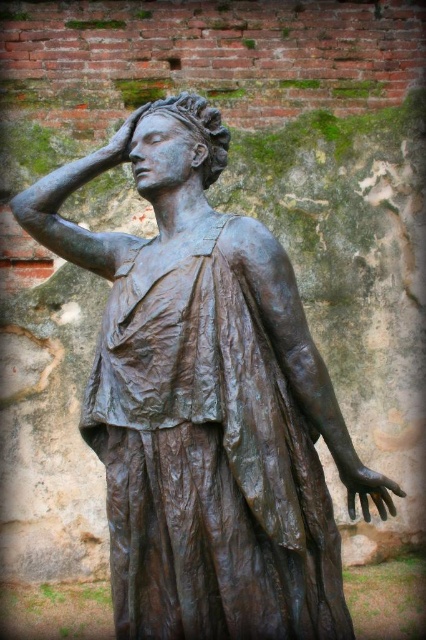
Question: Which point is farther from the camera taking this photo?

Choices:
 (A) (149, 112)
 (B) (121, 156)

Answer: (A)

Question: Is bronze hand at center below bronze hand at upper center?

Choices:
 (A) yes
 (B) no

Answer: (A)

Question: From the image, what is the correct spatial relationship of bronze statue head at center in relation to bronze hand at upper center?

Choices:
 (A) below
 (B) above

Answer: (A)

Question: Can you confirm if bronze statue head at center is bigger than bronze hand at upper center?

Choices:
 (A) no
 (B) yes

Answer: (B)

Question: Which point is closer to the camera?

Choices:
 (A) (222, 163)
 (B) (370, 486)

Answer: (B)

Question: Which of the following is the farthest from the observer?

Choices:
 (A) bronze hand at upper center
 (B) bronze statue head at center
 (C) bronze hand at center

Answer: (A)